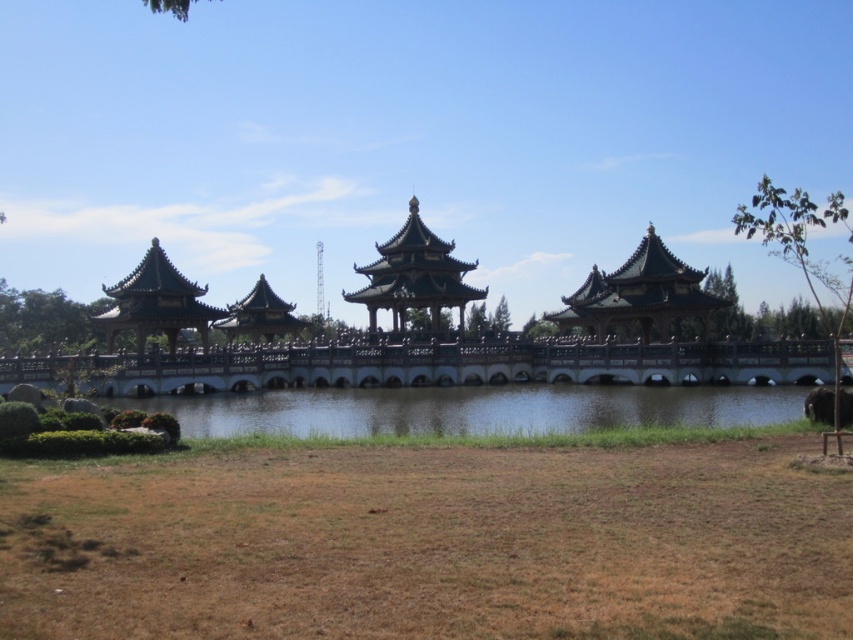
You are standing at the camera position and want to reach point (350, 372). Is the distance more than 100 meters?

Yes, the distance between point (350, 372) and the camera is 115.99 meters, which is more than 100 meters.